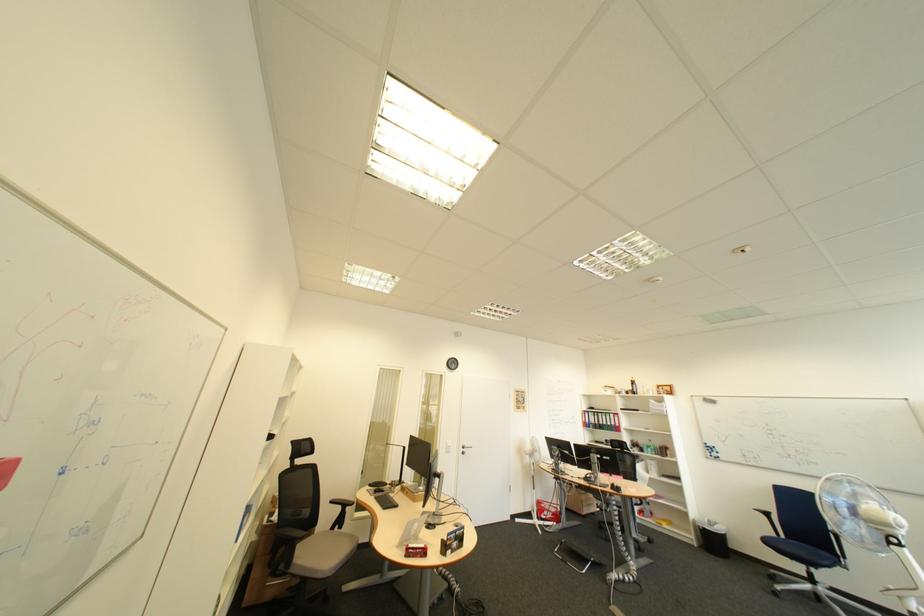
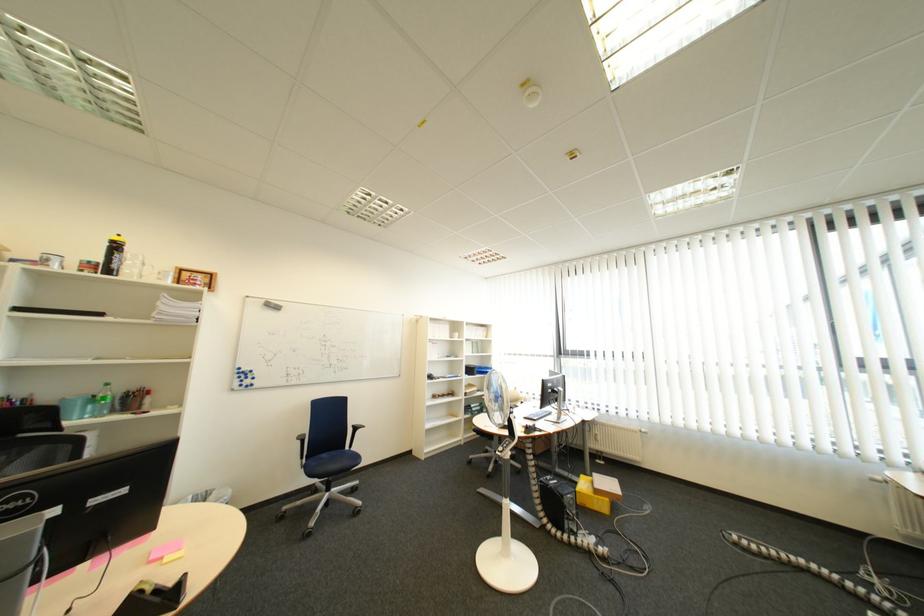
Locate, in the second image, the point that corresponds to point (648, 392) in the first image.

(128, 267)